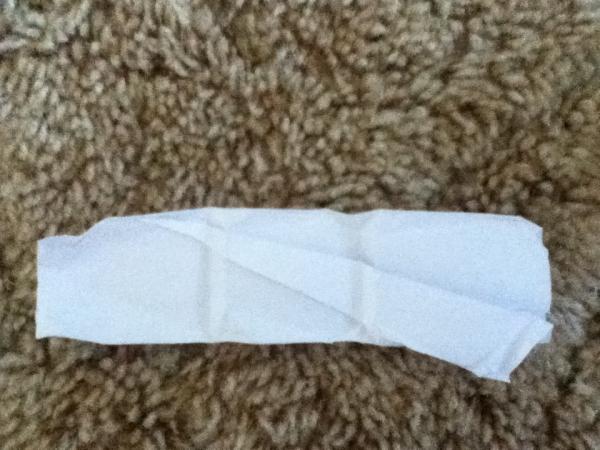
You are a GUI agent. You are given a task and a screenshot of the screen. Output one action in this format:
    pyautogui.click(x=<x>, y=<y>)
    Task: Click on the darker patches in rug
    
    Given the screenshot: What is the action you would take?
    pyautogui.click(x=505, y=156), pyautogui.click(x=268, y=102), pyautogui.click(x=253, y=134), pyautogui.click(x=126, y=406), pyautogui.click(x=478, y=410)